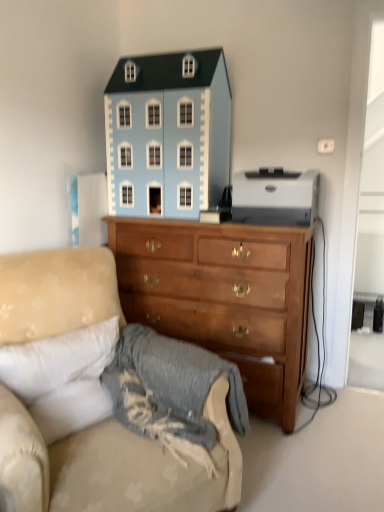
Question: Is white glossy printer at upper right, which is counted as the 2th toy, starting from the left, further to camera compared to light blue painted wood dollhouse at upper center, which is the 2th toy in right-to-left order?

Choices:
 (A) no
 (B) yes

Answer: (A)

Question: From a real-world perspective, is white glossy printer at upper right, the first toy in the right-to-left sequence, positioned over light blue painted wood dollhouse at upper center, which is the 2th toy in right-to-left order, based on gravity?

Choices:
 (A) no
 (B) yes

Answer: (A)

Question: Is light blue painted wood dollhouse at upper center, which is the 2th toy in right-to-left order, at the back of white glossy printer at upper right, the first toy in the right-to-left sequence?

Choices:
 (A) no
 (B) yes

Answer: (A)

Question: Is there a large distance between white glossy printer at upper right, the first toy in the right-to-left sequence, and light blue painted wood dollhouse at upper center, which is the 2th toy in right-to-left order?

Choices:
 (A) no
 (B) yes

Answer: (A)

Question: Is white glossy printer at upper right, the first toy in the right-to-left sequence, placed right next to light blue painted wood dollhouse at upper center, marked as the 1th toy in a left-to-right arrangement?

Choices:
 (A) yes
 (B) no

Answer: (B)

Question: Is point (302, 193) positioned closer to the camera than point (276, 239)?

Choices:
 (A) farther
 (B) closer

Answer: (B)

Question: Is white glossy printer at upper right, the first toy in the right-to-left sequence, inside or outside of wooden chest of drawers at center?

Choices:
 (A) inside
 (B) outside

Answer: (B)

Question: Is white glossy printer at upper right, which is counted as the 2th toy, starting from the left, bigger or smaller than wooden chest of drawers at center?

Choices:
 (A) big
 (B) small

Answer: (B)

Question: From a real-world perspective, is white glossy printer at upper right, the first toy in the right-to-left sequence, positioned above or below wooden chest of drawers at center?

Choices:
 (A) below
 (B) above

Answer: (B)

Question: Is wooden chest of drawers at center situated inside white glossy printer at upper right, which is counted as the 2th toy, starting from the left, or outside?

Choices:
 (A) inside
 (B) outside

Answer: (B)

Question: Visually, is wooden chest of drawers at center positioned to the left or to the right of white glossy printer at upper right, which is counted as the 2th toy, starting from the left?

Choices:
 (A) left
 (B) right

Answer: (A)

Question: Considering the positions of wooden chest of drawers at center and white glossy printer at upper right, the first toy in the right-to-left sequence, in the image, is wooden chest of drawers at center taller or shorter than white glossy printer at upper right, the first toy in the right-to-left sequence,?

Choices:
 (A) tall
 (B) short

Answer: (A)

Question: Is wooden chest of drawers at center in front of or behind white glossy printer at upper right, which is counted as the 2th toy, starting from the left, in the image?

Choices:
 (A) front
 (B) behind

Answer: (A)

Question: Considering the positions of point (162, 135) and point (317, 185), is point (162, 135) closer or farther from the camera than point (317, 185)?

Choices:
 (A) closer
 (B) farther

Answer: (A)

Question: From a real-world perspective, is light blue painted wood dollhouse at upper center, marked as the 1th toy in a left-to-right arrangement, physically located above or below white glossy printer at upper right, the first toy in the right-to-left sequence?

Choices:
 (A) below
 (B) above

Answer: (B)